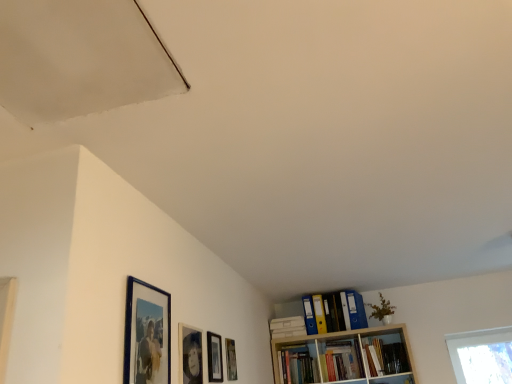
Question: Considering the relative sizes of matte black picture frame at center, placed as the second picture frame when sorted from back to front, and blue glossy picture frame at upper left, acting as the 1th picture frame starting from the front, in the image provided, is matte black picture frame at center, placed as the second picture frame when sorted from back to front, smaller than blue glossy picture frame at upper left, acting as the 1th picture frame starting from the front,?

Choices:
 (A) yes
 (B) no

Answer: (A)

Question: Does matte black picture frame at center, placed as the third picture frame when sorted from front to back, have a lesser height compared to blue glossy picture frame at upper left, the fourth picture frame in the back-to-front sequence?

Choices:
 (A) no
 (B) yes

Answer: (B)

Question: Is matte black picture frame at center, the 3th picture frame from the left, outside of blue glossy picture frame at upper left, acting as the 1th picture frame starting from the front?

Choices:
 (A) yes
 (B) no

Answer: (A)

Question: From the image's perspective, is matte black picture frame at center, which is counted as the 2th picture frame, starting from the right, over blue glossy picture frame at upper left, the fourth picture frame in the back-to-front sequence?

Choices:
 (A) no
 (B) yes

Answer: (A)

Question: Considering the relative sizes of matte black picture frame at center, placed as the third picture frame when sorted from front to back, and blue glossy picture frame at upper left, which is the 4th picture frame from right to left, in the image provided, is matte black picture frame at center, placed as the third picture frame when sorted from front to back, wider than blue glossy picture frame at upper left, which is the 4th picture frame from right to left,?

Choices:
 (A) yes
 (B) no

Answer: (B)

Question: From a real-world perspective, relative to smooth white exhaust hood at upper left, is matte wooden picture frame at lower center, placed as the first picture frame when sorted from right to left, vertically above or below?

Choices:
 (A) above
 (B) below

Answer: (B)

Question: From the image's perspective, relative to smooth white exhaust hood at upper left, is matte wooden picture frame at lower center, which ranks as the first picture frame in back-to-front order, above or below?

Choices:
 (A) above
 (B) below

Answer: (B)

Question: Is matte wooden picture frame at lower center, which ranks as the first picture frame in back-to-front order, spatially inside smooth white exhaust hood at upper left, or outside of it?

Choices:
 (A) outside
 (B) inside

Answer: (A)

Question: Visually, is matte wooden picture frame at lower center, placed as the first picture frame when sorted from right to left, positioned to the left or to the right of smooth white exhaust hood at upper left?

Choices:
 (A) left
 (B) right

Answer: (B)

Question: From their relative heights in the image, would you say yellow file folder at upper right, placed as the 1th book when sorted from left to right, is taller or shorter than blue glossy picture frame at upper left, marked as the first picture frame in a left-to-right arrangement?

Choices:
 (A) tall
 (B) short

Answer: (B)

Question: Is yellow file folder at upper right, marked as the 2th book in a right-to-left arrangement, wider or thinner than blue glossy picture frame at upper left, the fourth picture frame in the back-to-front sequence?

Choices:
 (A) wide
 (B) thin

Answer: (A)

Question: Is yellow file folder at upper right, placed as the 1th book when sorted from left to right, spatially inside blue glossy picture frame at upper left, acting as the 1th picture frame starting from the front, or outside of it?

Choices:
 (A) outside
 (B) inside

Answer: (A)

Question: Visually, is yellow file folder at upper right, placed as the 1th book when sorted from left to right, positioned to the left or to the right of blue glossy picture frame at upper left, which is the 4th picture frame from right to left?

Choices:
 (A) left
 (B) right

Answer: (B)

Question: From a real-world perspective, is yellow file folder at upper right, placed as the 1th book when sorted from left to right, positioned above or below matte black picture frame at lower center, which is the second picture frame from left to right?

Choices:
 (A) below
 (B) above

Answer: (B)

Question: In terms of height, does yellow file folder at upper right, marked as the 2th book in a right-to-left arrangement, look taller or shorter compared to matte black picture frame at lower center, arranged as the 3th picture frame when viewed from the right?

Choices:
 (A) tall
 (B) short

Answer: (B)